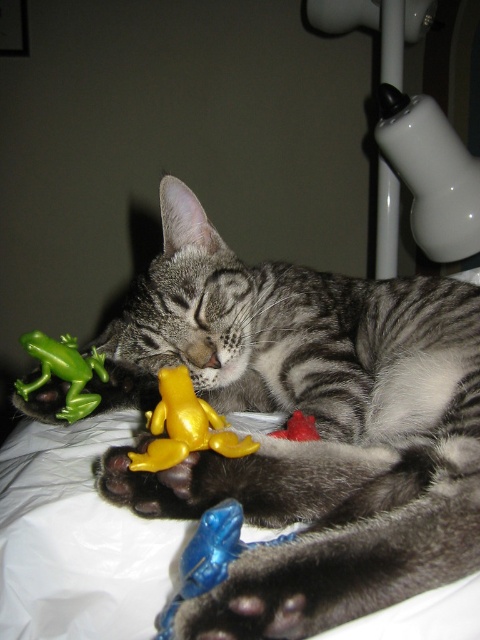
Question: Is gray striped fur cat at center in front of blue rubber toy at lower center?

Choices:
 (A) yes
 (B) no

Answer: (A)

Question: Which of the following is the closest to the observer?

Choices:
 (A) (231, 381)
 (B) (207, 436)
 (C) (194, 589)
 (D) (69, 349)

Answer: (C)

Question: Does gray striped fur cat at center appear over yellow rubber frog at center?

Choices:
 (A) yes
 (B) no

Answer: (A)

Question: Is yellow rubber frog at center further to the viewer compared to blue rubber toy at lower center?

Choices:
 (A) no
 (B) yes

Answer: (B)

Question: Estimate the real-world distances between objects in this image. Which object is farther from the blue rubber toy at lower center?

Choices:
 (A) yellow rubber frog at center
 (B) gray striped fur cat at center

Answer: (B)

Question: Among these points, which one is nearest to the camera?

Choices:
 (A) (132, 324)
 (B) (170, 372)

Answer: (B)